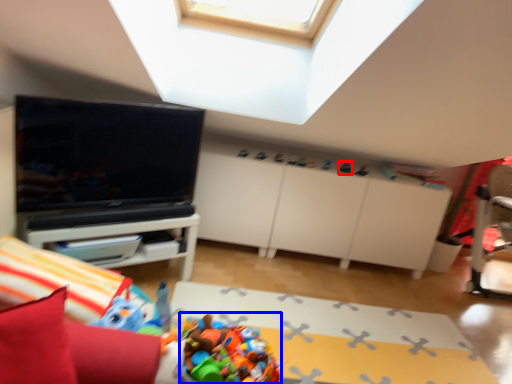
Question: Which object is closer to the camera taking this photo, toy (highlighted by a red box) or toy (highlighted by a blue box)?

Choices:
 (A) toy
 (B) toy

Answer: (B)